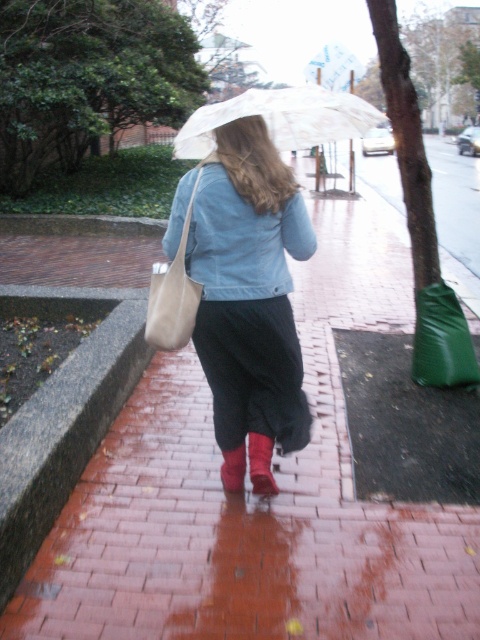
Is transparent plastic umbrella at upper center positioned behind beige leather bag at center?

That is False.

Is transparent plastic umbrella at upper center bigger than beige leather bag at center?

Correct, transparent plastic umbrella at upper center is larger in size than beige leather bag at center.

Which is in front, point (278, 113) or point (155, 336)?

Positioned in front is point (155, 336).

This screenshot has width=480, height=640. I want to click on transparent plastic umbrella at upper center, so click(x=282, y=118).

Between point (280, 305) and point (180, 282), which one is positioned in front?

Point (180, 282) is more forward.

Can you confirm if matte black skirt at center is wider than beige leather bag at center?

Yes.

Is point (213, 230) positioned in front of point (173, 320)?

Yes, it is in front of point (173, 320).

Find the location of `matte black skirt at center`. matte black skirt at center is located at coordinates (249, 285).

Can you confirm if transparent plastic umbrella at upper center is wider than green matte shopping bag at lower right?

Yes.

At what (x,y) coordinates should I click in order to perform the action: click on transparent plastic umbrella at upper center. Please return your answer as a coordinate pair (x, y). The height and width of the screenshot is (640, 480). Looking at the image, I should click on (282, 118).